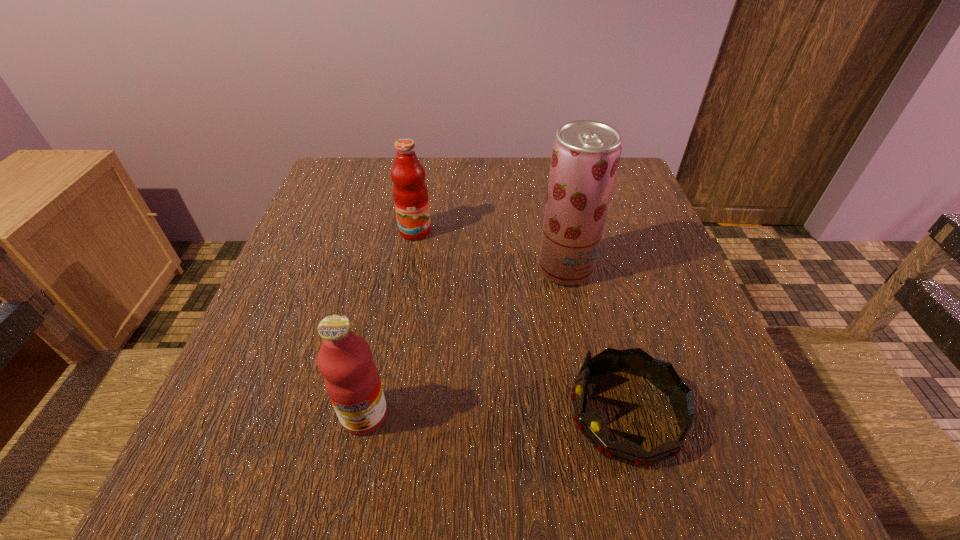
You are a GUI agent. You are given a task and a screenshot of the screen. Output one action in this format:
    pyautogui.click(x=<x>, y=<y>)
    Task: Click on the vacant region located 0.170m at the front of the tiara with jewels
    
    Given the screenshot: What is the action you would take?
    pyautogui.click(x=456, y=414)

Image resolution: width=960 pixels, height=540 pixels. I want to click on object that is at the near edge, so click(x=592, y=424).

Find the location of a particular element. object positioned at the right edge is located at coordinates (592, 424).

Image resolution: width=960 pixels, height=540 pixels. Identify the location of object at the near right corner. (592, 424).

Where is `free space at the far edge of the desktop`? Image resolution: width=960 pixels, height=540 pixels. free space at the far edge of the desktop is located at coordinates (478, 203).

Find the location of a particular element. The height and width of the screenshot is (540, 960). free space at the near edge of the desktop is located at coordinates point(561,473).

You are a GUI agent. You are given a task and a screenshot of the screen. Output one action in this format:
    pyautogui.click(x=<x>, y=<y>)
    Task: Click on the vacant space at the left edge of the desktop
    This screenshot has width=960, height=540.
    Given the screenshot: What is the action you would take?
    (x=285, y=280)

Image resolution: width=960 pixels, height=540 pixels. In the image, there is a desktop. Identify the location of vacant space at the right edge. (738, 429).

You are a GUI agent. You are given a task and a screenshot of the screen. Output one action in this format:
    pyautogui.click(x=<x>, y=<y>)
    Task: Click on the free region at the near left corner of the desktop
    
    Given the screenshot: What is the action you would take?
    pyautogui.click(x=303, y=447)

In the image, there is a desktop. Identify the location of vacant region at the far right corner. (621, 202).